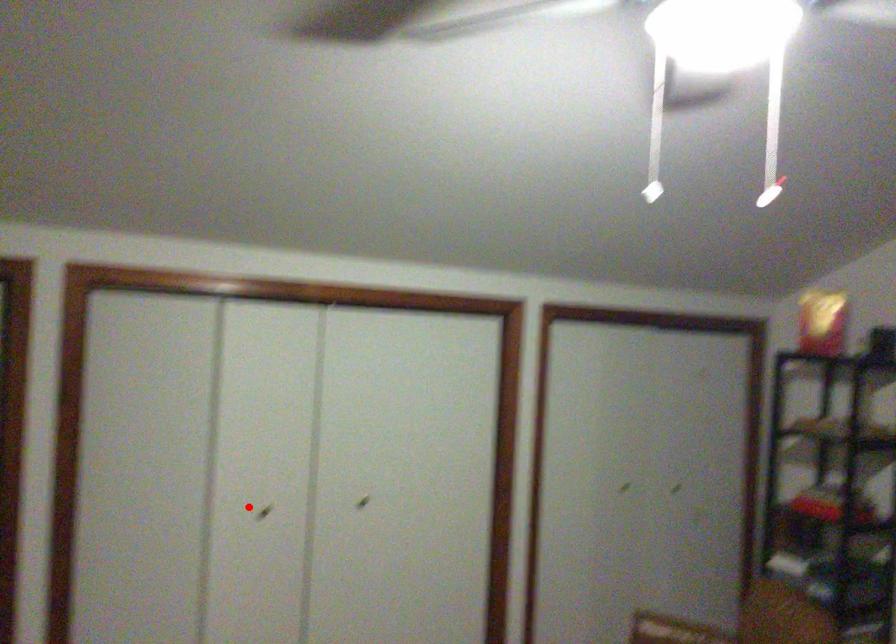
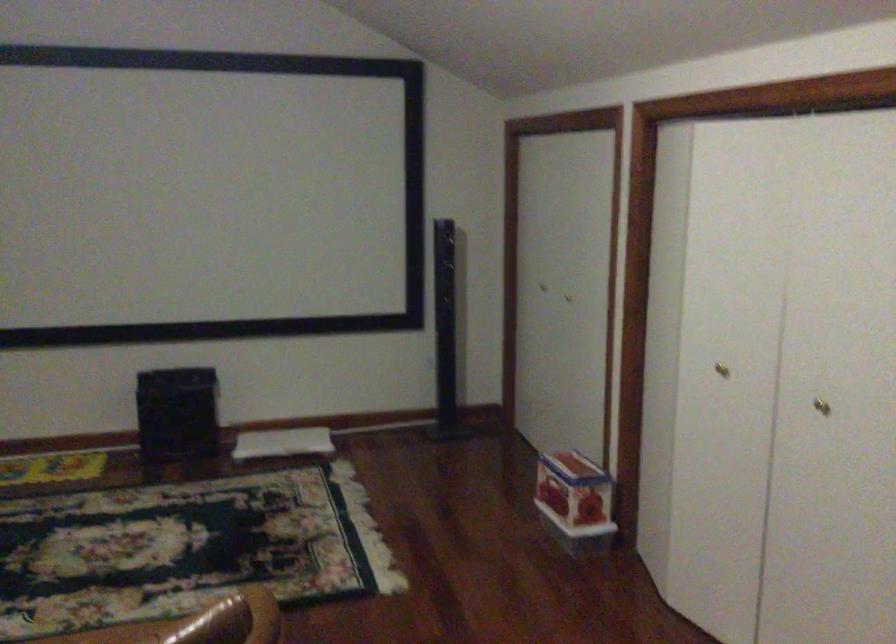
Question: I am providing you with two images of the same scene from different viewpoints. A red point is shown in image1. For the corresponding object point in image2, is it positioned nearer or farther from the camera?

Choices:
 (A) Nearer
 (B) Farther

Answer: (A)